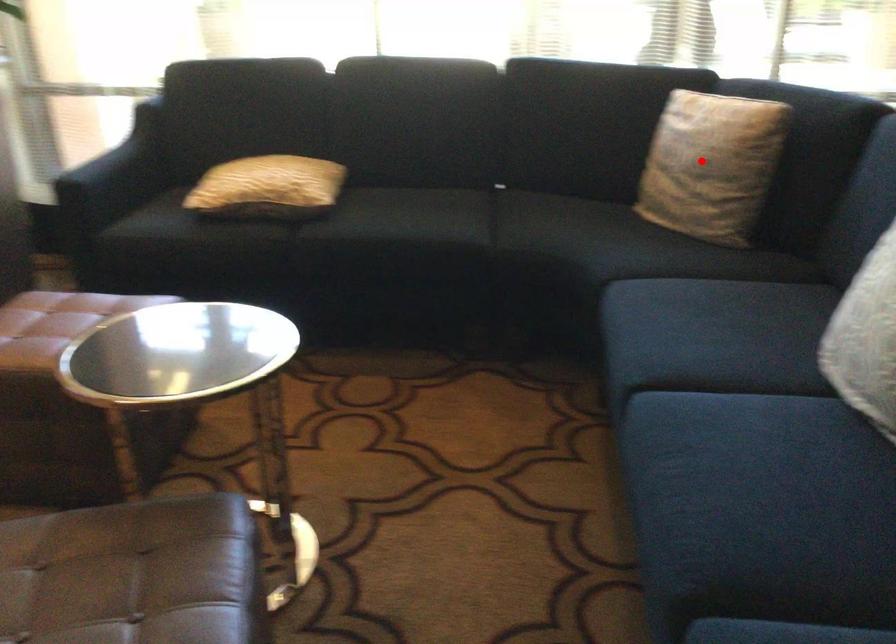
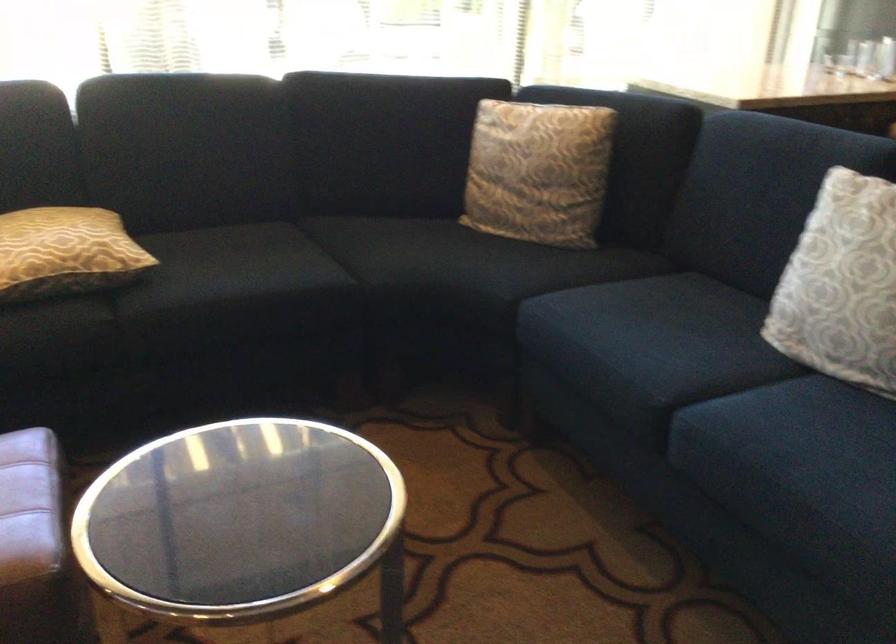
Locate, in the second image, the point that corresponds to the highlighted location in the first image.

(538, 172)